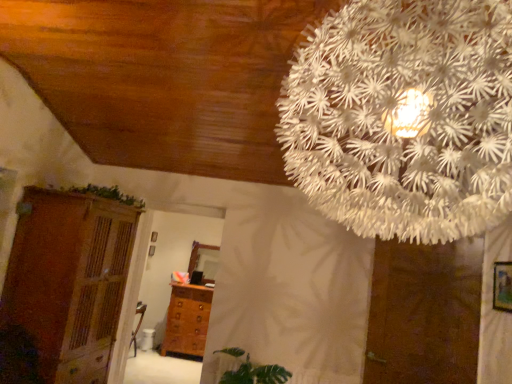
Question: Would you say wooden picture frame at right is a long distance from brown wooden dresser at left?

Choices:
 (A) no
 (B) yes

Answer: (B)

Question: Does wooden picture frame at right appear on the left side of brown wooden dresser at left?

Choices:
 (A) yes
 (B) no

Answer: (B)

Question: Can you confirm if wooden picture frame at right is wider than brown wooden dresser at left?

Choices:
 (A) no
 (B) yes

Answer: (A)

Question: Would you say wooden picture frame at right contains brown wooden dresser at left?

Choices:
 (A) yes
 (B) no

Answer: (B)

Question: Is wooden picture frame at right further to the viewer compared to brown wooden dresser at left?

Choices:
 (A) yes
 (B) no

Answer: (B)

Question: Based on their sizes in the image, would you say green leafy plant at upper left is bigger or smaller than white paper flower at upper center?

Choices:
 (A) small
 (B) big

Answer: (A)

Question: Is green leafy plant at upper left wider or thinner than white paper flower at upper center?

Choices:
 (A) thin
 (B) wide

Answer: (A)

Question: Does point (89, 190) appear closer or farther from the camera than point (391, 150)?

Choices:
 (A) farther
 (B) closer

Answer: (A)

Question: From the image's perspective, is green leafy plant at upper left positioned above or below white paper flower at upper center?

Choices:
 (A) below
 (B) above

Answer: (A)

Question: From a real-world perspective, relative to wooden chest of drawers at center, is brown matte door at lower right vertically above or below?

Choices:
 (A) above
 (B) below

Answer: (A)

Question: Is brown matte door at lower right taller or shorter than wooden chest of drawers at center?

Choices:
 (A) tall
 (B) short

Answer: (A)

Question: Is brown matte door at lower right situated inside wooden chest of drawers at center or outside?

Choices:
 (A) inside
 (B) outside

Answer: (B)

Question: Considering the positions of point (423, 294) and point (180, 350), is point (423, 294) closer or farther from the camera than point (180, 350)?

Choices:
 (A) closer
 (B) farther

Answer: (A)

Question: In the image, is brown wooden dresser at left positioned in front of or behind wooden chest of drawers at center?

Choices:
 (A) front
 (B) behind

Answer: (A)

Question: Does point (24, 187) appear closer or farther from the camera than point (164, 337)?

Choices:
 (A) closer
 (B) farther

Answer: (A)